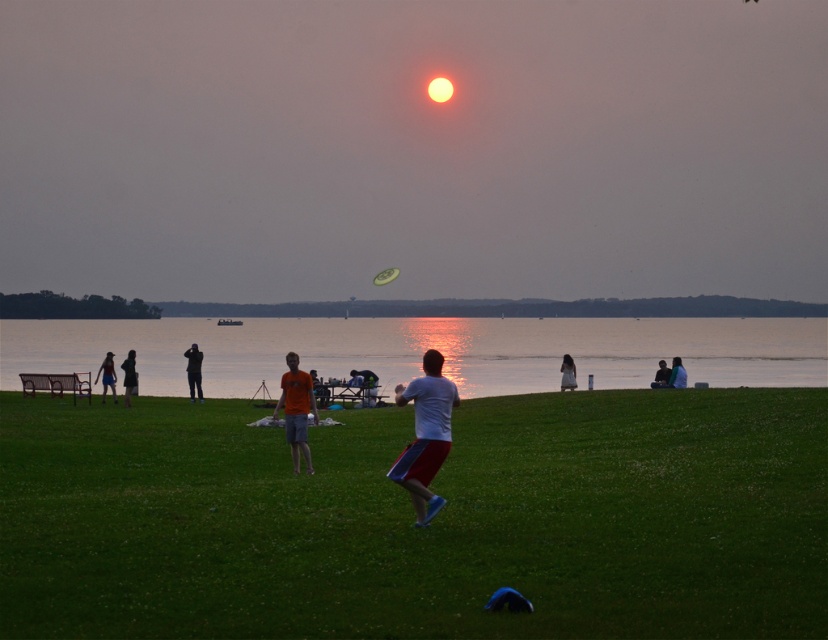
You are standing at the edge of the lakeside and want to walk towards the green grass at center. According to the coordinates provided, in which direction should you head from your current position?

The green grass at center is located at point coordinates, so you should head towards the center area from your current position at the edge of the lakeside.

You are standing at the edge of the lake and want to locate the reflective silver water at center. According to the coordinates provided, in which direction should you look relative to your position?

The reflective silver water at center is located at coordinates point [424,349]. Since the coordinates are in the center of the image, you should look straight ahead to find it.